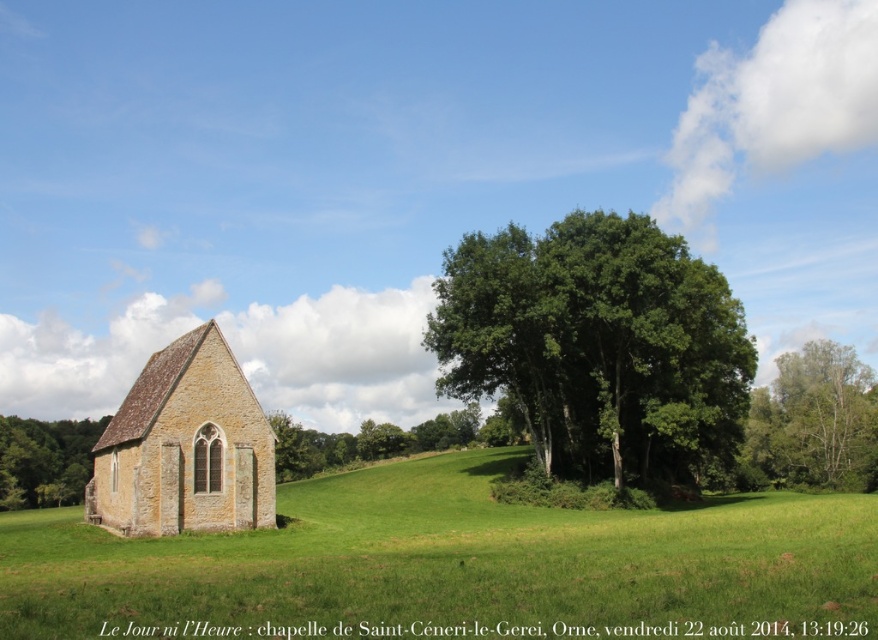
Is green grassy field at lower left wider than green leafy tree at center?

Indeed, green grassy field at lower left has a greater width compared to green leafy tree at center.

Can you confirm if green grassy field at lower left is positioned to the left of green leafy tree at center?

Correct, you'll find green grassy field at lower left to the left of green leafy tree at center.

Who is more forward, (290, 518) or (466, 333)?

Point (290, 518) is more forward.

Where is `green grassy field at lower left`? This screenshot has width=878, height=640. green grassy field at lower left is located at coordinates (450, 561).

Does yellow stone church at left come in front of green leafy tree at right?

Yes, yellow stone church at left is closer to the viewer.

At what (x,y) coordinates should I click in order to perform the action: click on yellow stone church at left. Please return your answer as a coordinate pair (x, y). This screenshot has height=640, width=878. Looking at the image, I should click on (185, 445).

Image resolution: width=878 pixels, height=640 pixels. I want to click on yellow stone church at left, so click(x=185, y=445).

From the picture: Does green grassy field at lower left appear on the right side of green leafy tree at right?

Incorrect, green grassy field at lower left is not on the right side of green leafy tree at right.

Does green grassy field at lower left have a lesser width compared to green leafy tree at right?

In fact, green grassy field at lower left might be wider than green leafy tree at right.

The image size is (878, 640). In order to click on green grassy field at lower left in this screenshot , I will do `click(450, 561)`.